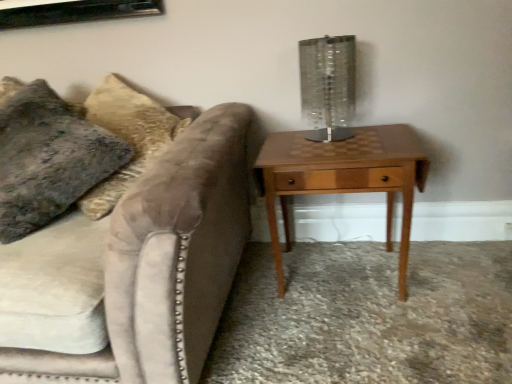
You are a GUI agent. You are given a task and a screenshot of the screen. Output one action in this format:
    pyautogui.click(x=<x>, y=<y>)
    Task: Click on the vacant space positioned to the left of clear glass table lamp at upper right
    Image resolution: width=512 pixels, height=384 pixels.
    Given the screenshot: What is the action you would take?
    pyautogui.click(x=282, y=148)